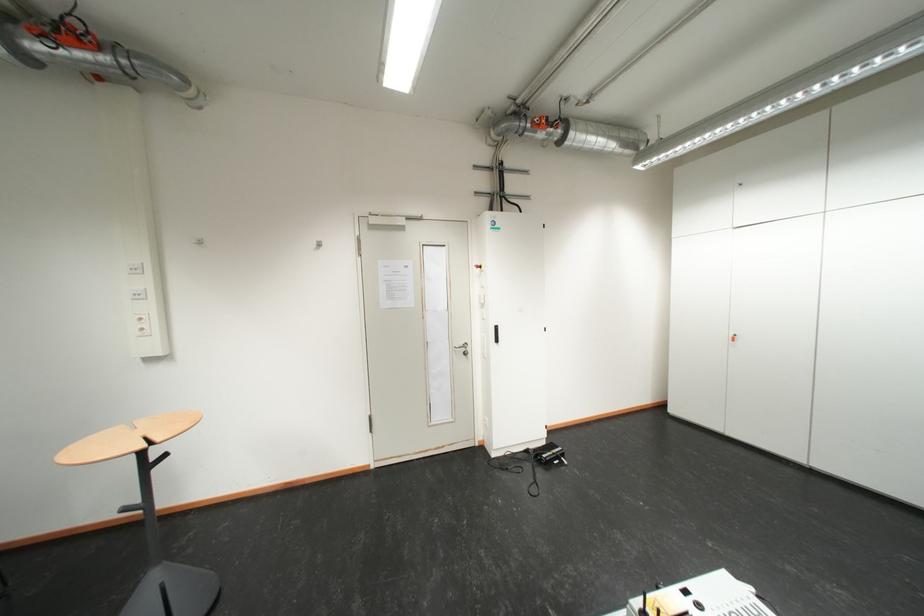
Where would you push the white wall switch? Please return your answer as a coordinate pair (x, y).

(134, 267)